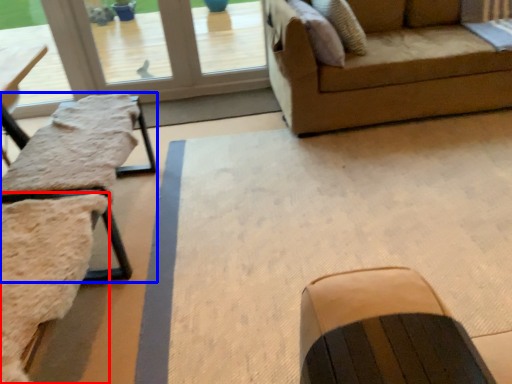
Question: Among these objects, which one is nearest to the camera, swivel chair (highlighted by a red box) or table (highlighted by a blue box)?

Choices:
 (A) swivel chair
 (B) table

Answer: (A)